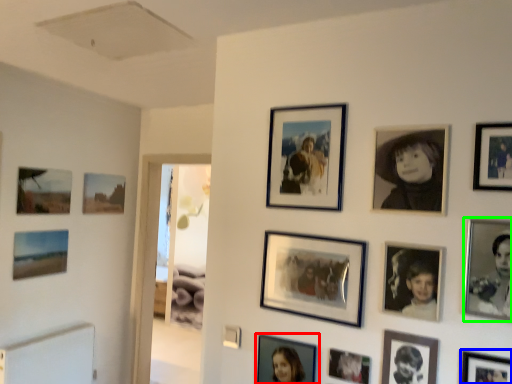
Question: Based on their relative distances, which object is farther from picture frame (highlighted by a red box)? Choose from picture frame (highlighted by a blue box) and picture frame (highlighted by a green box).

Choices:
 (A) picture frame
 (B) picture frame

Answer: (B)